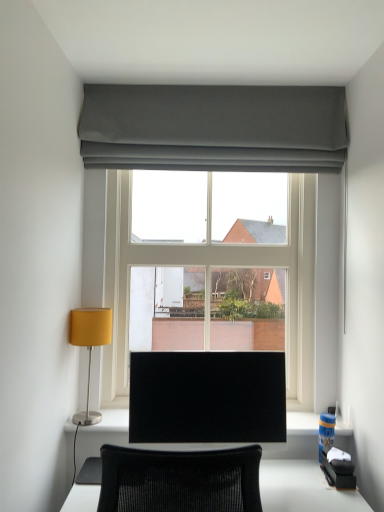
Question: From a real-world perspective, is matte yellow lampshade at left located higher than dark gray fabric at upper center?

Choices:
 (A) yes
 (B) no

Answer: (B)

Question: Can you confirm if matte yellow lampshade at left is smaller than dark gray fabric at upper center?

Choices:
 (A) no
 (B) yes

Answer: (B)

Question: Considering the relative sizes of matte yellow lampshade at left and dark gray fabric at upper center in the image provided, is matte yellow lampshade at left bigger than dark gray fabric at upper center?

Choices:
 (A) yes
 (B) no

Answer: (B)

Question: From a real-world perspective, is matte yellow lampshade at left below dark gray fabric at upper center?

Choices:
 (A) yes
 (B) no

Answer: (A)

Question: Is matte yellow lampshade at left facing towards dark gray fabric at upper center?

Choices:
 (A) no
 (B) yes

Answer: (A)

Question: From the image's perspective, is black glossy monitor at center positioned above or below clear glass window at center?

Choices:
 (A) below
 (B) above

Answer: (A)

Question: Would you say black glossy monitor at center is inside or outside clear glass window at center?

Choices:
 (A) outside
 (B) inside

Answer: (A)

Question: Does point (193, 421) appear closer or farther from the camera than point (253, 146)?

Choices:
 (A) closer
 (B) farther

Answer: (A)

Question: From a real-world perspective, is black glossy monitor at center above or below clear glass window at center?

Choices:
 (A) above
 (B) below

Answer: (B)

Question: Considering the positions of matte yellow lampshade at left and dark gray fabric at upper center in the image, is matte yellow lampshade at left wider or thinner than dark gray fabric at upper center?

Choices:
 (A) thin
 (B) wide

Answer: (B)

Question: From a real-world perspective, is matte yellow lampshade at left positioned above or below dark gray fabric at upper center?

Choices:
 (A) below
 (B) above

Answer: (A)

Question: In the image, is matte yellow lampshade at left on the left side or the right side of dark gray fabric at upper center?

Choices:
 (A) left
 (B) right

Answer: (A)

Question: In terms of height, does matte yellow lampshade at left look taller or shorter compared to dark gray fabric at upper center?

Choices:
 (A) tall
 (B) short

Answer: (A)

Question: From their relative heights in the image, would you say clear glass window at center is taller or shorter than black glossy monitor at center?

Choices:
 (A) short
 (B) tall

Answer: (B)

Question: Does point (332, 122) appear closer or farther from the camera than point (130, 399)?

Choices:
 (A) farther
 (B) closer

Answer: (A)